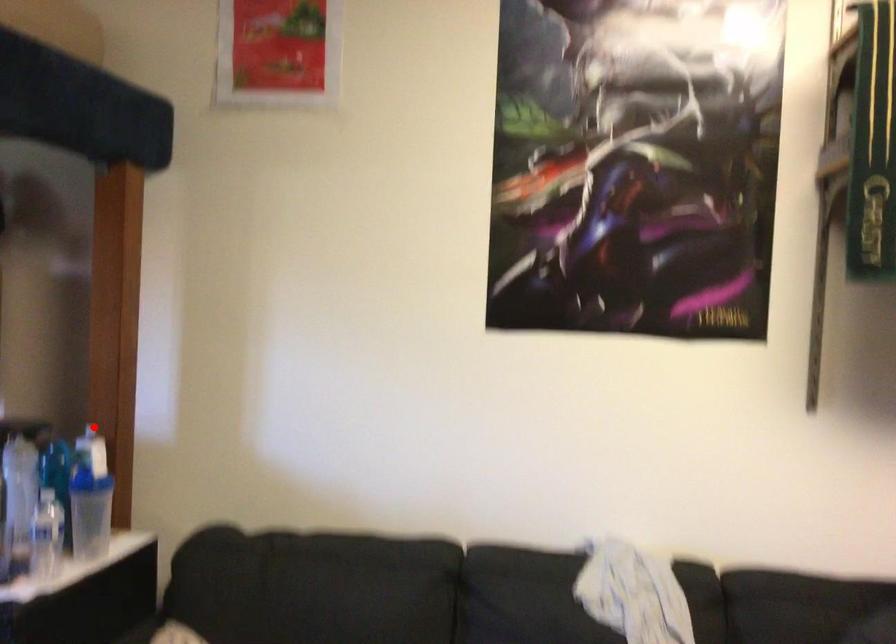
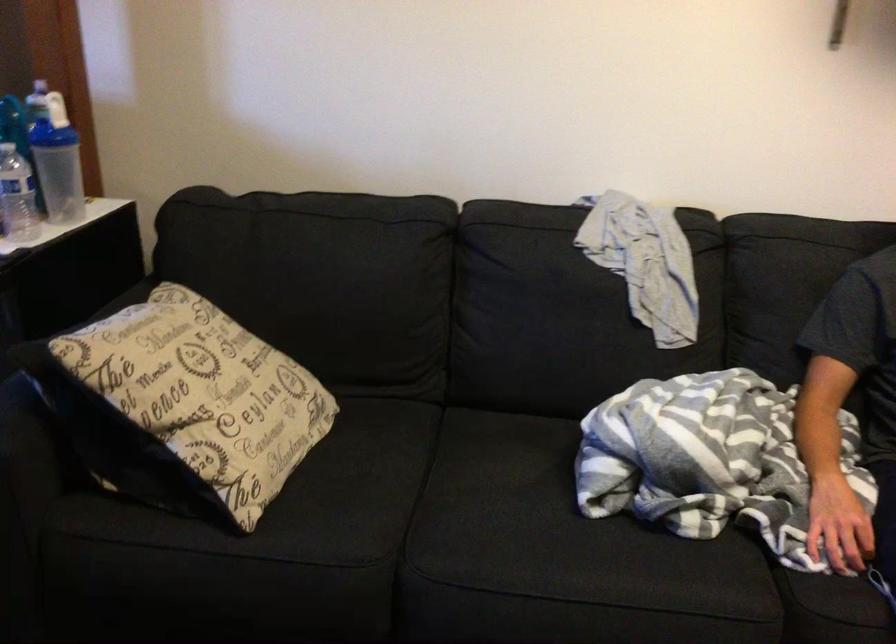
Question: I am providing you with two images of the same scene from different viewpoints. In image1, a red point is highlighted. Considering the same 3D point in image2, which of the following is correct?

Choices:
 (A) It is closer
 (B) It is farther

Answer: (A)